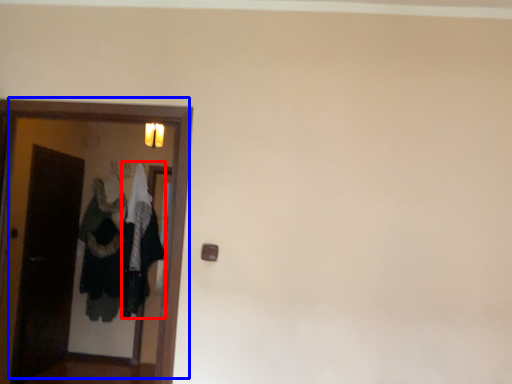
Question: Which object is further to the camera taking this photo, clothing (highlighted by a red box) or door (highlighted by a blue box)?

Choices:
 (A) clothing
 (B) door

Answer: (A)